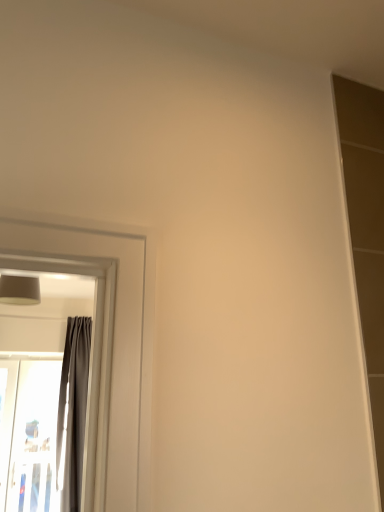
Question: Does matte gray lampshade at upper left turn towards gray fabric curtain at left?

Choices:
 (A) no
 (B) yes

Answer: (A)

Question: Considering the relative sizes of matte gray lampshade at upper left and gray fabric curtain at left in the image provided, is matte gray lampshade at upper left smaller than gray fabric curtain at left?

Choices:
 (A) yes
 (B) no

Answer: (A)

Question: Is matte gray lampshade at upper left located outside gray fabric curtain at left?

Choices:
 (A) yes
 (B) no

Answer: (A)

Question: Considering the relative sizes of matte gray lampshade at upper left and gray fabric curtain at left in the image provided, is matte gray lampshade at upper left wider than gray fabric curtain at left?

Choices:
 (A) no
 (B) yes

Answer: (B)

Question: Is gray fabric curtain at left at the back of matte gray lampshade at upper left?

Choices:
 (A) no
 (B) yes

Answer: (A)

Question: From a real-world perspective, is transparent plastic screen door at left physically located above or below gray fabric curtain at left?

Choices:
 (A) below
 (B) above

Answer: (A)

Question: Visually, is transparent plastic screen door at left positioned to the left or to the right of gray fabric curtain at left?

Choices:
 (A) left
 (B) right

Answer: (A)

Question: Looking at the image, does transparent plastic screen door at left seem bigger or smaller compared to gray fabric curtain at left?

Choices:
 (A) small
 (B) big

Answer: (A)

Question: In terms of width, does transparent plastic screen door at left look wider or thinner when compared to gray fabric curtain at left?

Choices:
 (A) thin
 (B) wide

Answer: (A)

Question: Considering the positions of matte gray lampshade at upper left and transparent plastic screen door at left in the image, is matte gray lampshade at upper left bigger or smaller than transparent plastic screen door at left?

Choices:
 (A) small
 (B) big

Answer: (A)

Question: From a real-world perspective, relative to transparent plastic screen door at left, is matte gray lampshade at upper left vertically above or below?

Choices:
 (A) above
 (B) below

Answer: (A)

Question: In terms of height, does matte gray lampshade at upper left look taller or shorter compared to transparent plastic screen door at left?

Choices:
 (A) tall
 (B) short

Answer: (B)

Question: In the image, is matte gray lampshade at upper left positioned in front of or behind transparent plastic screen door at left?

Choices:
 (A) behind
 (B) front

Answer: (B)

Question: Do you think transparent plastic screen door at left is within matte gray lampshade at upper left, or outside of it?

Choices:
 (A) outside
 (B) inside

Answer: (A)

Question: In terms of height, does transparent plastic screen door at left look taller or shorter compared to matte gray lampshade at upper left?

Choices:
 (A) tall
 (B) short

Answer: (A)